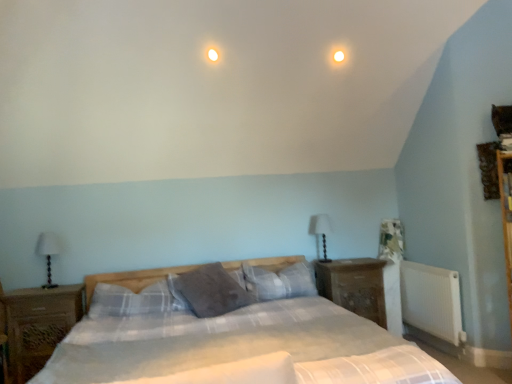
You are a GUI agent. You are given a task and a screenshot of the screen. Output one action in this format:
    pyautogui.click(x=<x>, y=<y>)
    Task: Click on the unoccupied region to the right of white fabric lampshade at left, which ranks as the first table lamp in front-to-back order
    The image size is (512, 384).
    Given the screenshot: What is the action you would take?
    pyautogui.click(x=70, y=287)